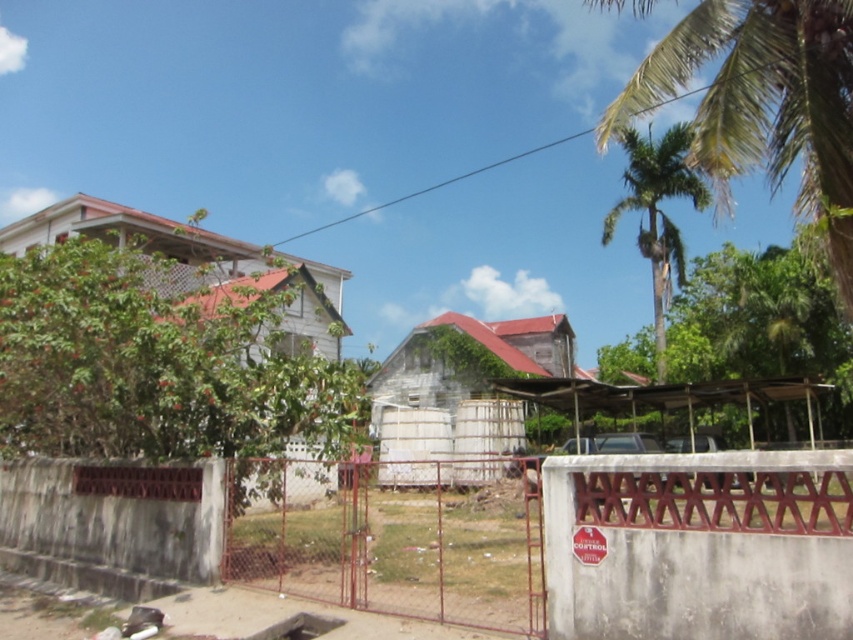
You are a delivery person trying to enter through the rusty metal gate at center. You notice a green leafy palm tree at upper right nearby. Which direction should you walk to reach the gate from the palm tree?

The rusty metal gate at center is positioned on the left side of the green leafy palm tree at upper right. Therefore, to reach the gate from the palm tree, you should walk to the left.

You are standing in front of the rusty metal gate at center and want to walk towards the green leafy palm tree at upper right. Which direction should you move to get closer to the palm tree?

The green leafy palm tree at upper right is located at upper right, so you should move towards the upper right direction to get closer to it.

You are a delivery robot with a width of 1.2 meters. You need to pass through the rusty metal gate at center to deliver a package. Can you fit through the gate?

The distance between the rusty metal gate at center and the camera is 5.22 meters. This measurement refers to the distance from the viewer to the gate, not the width of the gate itself. Therefore, it is not possible to determine if the robot can fit through the gate based on the provided information.